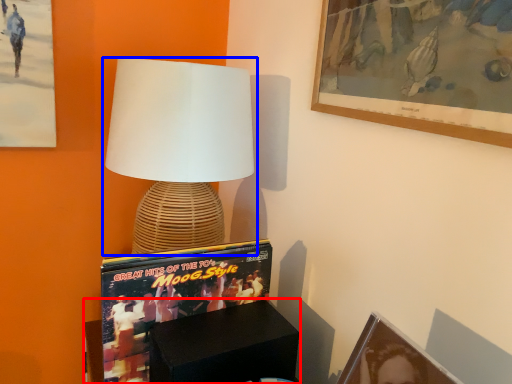
Question: Which point is closer to the camera, furniture (highlighted by a red box) or lamp (highlighted by a blue box)?

Choices:
 (A) furniture
 (B) lamp

Answer: (A)